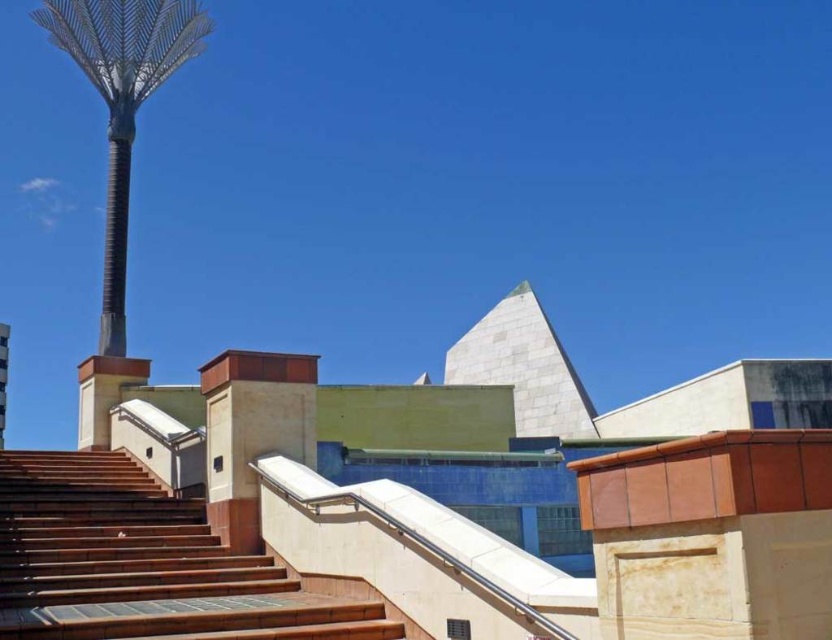
Is white marble pyramid at upper center to the left of brown metallic pole at upper left from the viewer's perspective?

Incorrect, white marble pyramid at upper center is not on the left side of brown metallic pole at upper left.

Is white marble pyramid at upper center above brown metallic pole at upper left?

Actually, white marble pyramid at upper center is below brown metallic pole at upper left.

Is point (540, 403) positioned after point (109, 148)?

Yes, point (540, 403) is behind point (109, 148).

The height and width of the screenshot is (640, 832). I want to click on white marble pyramid at upper center, so click(523, 368).

Can you confirm if wooden stairs at lower left is shorter than brown metallic pole at upper left?

Indeed, wooden stairs at lower left has a lesser height compared to brown metallic pole at upper left.

Who is positioned more to the left, wooden stairs at lower left or brown metallic pole at upper left?

brown metallic pole at upper left is more to the left.

Locate an element on the screen. The image size is (832, 640). wooden stairs at lower left is located at coordinates (141, 563).

Where is `wooden stairs at lower left`? This screenshot has height=640, width=832. wooden stairs at lower left is located at coordinates (141, 563).

Which is in front, point (266, 570) or point (546, 353)?

Point (266, 570) is more forward.

Does wooden stairs at lower left appear under white marble pyramid at upper center?

Indeed, wooden stairs at lower left is positioned under white marble pyramid at upper center.

Between point (140, 625) and point (573, 376), which one is positioned in front?

Point (140, 625) is in front.

The width and height of the screenshot is (832, 640). I want to click on wooden stairs at lower left, so click(141, 563).